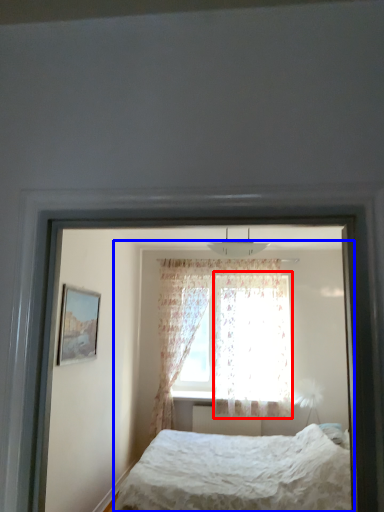
Question: Which object appears closest to the camera in this image, curtain (highlighted by a red box) or bed (highlighted by a blue box)?

Choices:
 (A) curtain
 (B) bed

Answer: (B)